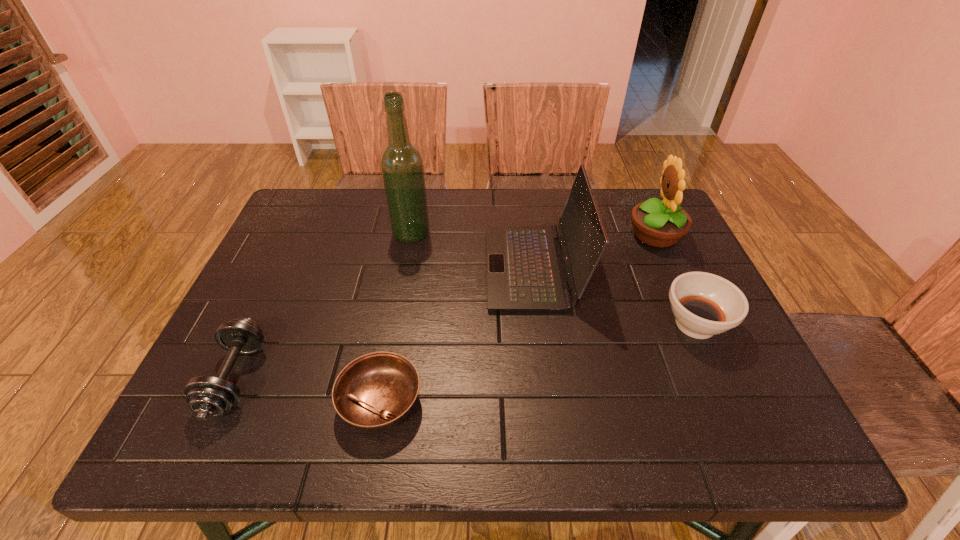
Where is `vacant space at the left edge of the desktop`? vacant space at the left edge of the desktop is located at coordinates (270, 296).

Locate an element on the screen. This screenshot has height=540, width=960. free space at the right edge of the desktop is located at coordinates (743, 408).

At what (x,y) coordinates should I click in order to perform the action: click on vacant space at the far left corner. Please return your answer as a coordinate pair (x, y). The image size is (960, 540). Looking at the image, I should click on (308, 189).

In order to click on vacant point at the far right corner in this screenshot , I will do `click(630, 201)`.

Locate an element on the screen. Image resolution: width=960 pixels, height=540 pixels. blank space at the near right corner of the desktop is located at coordinates (744, 436).

Image resolution: width=960 pixels, height=540 pixels. Find the location of `free area in between the liquor and the nearer soup bowl`. free area in between the liquor and the nearer soup bowl is located at coordinates (396, 318).

Locate an element on the screen. This screenshot has width=960, height=540. vacant area that lies between the left soup bowl and the sunflower is located at coordinates (517, 319).

This screenshot has width=960, height=540. Find the location of `vacant point located between the tallest object and the dumbbell`. vacant point located between the tallest object and the dumbbell is located at coordinates (324, 306).

What are the coordinates of `vacant space that is in between the dumbbell and the taller soup bowl` in the screenshot? It's located at (466, 352).

Locate an element on the screen. vacant space in between the shorter soup bowl and the tallest object is located at coordinates (396, 318).